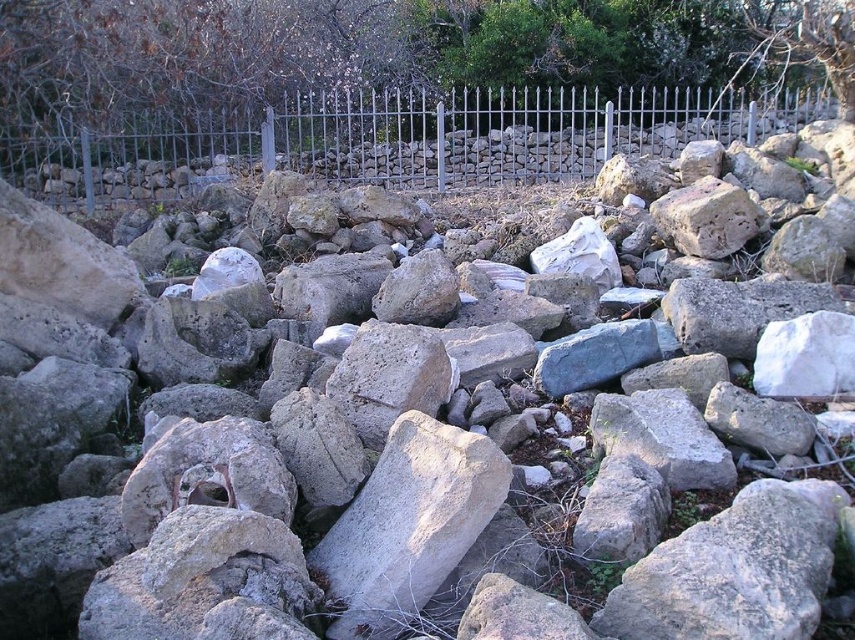
Does green leafy tree at upper center have a smaller size compared to metallic fence at upper center?

No.

Is point (397, 22) farther from camera compared to point (99, 198)?

Yes, point (397, 22) is behind point (99, 198).

Is point (382, 77) positioned in front of point (450, 163)?

No, it is not.

Where is `green leafy tree at upper center`? The image size is (855, 640). green leafy tree at upper center is located at coordinates (366, 51).